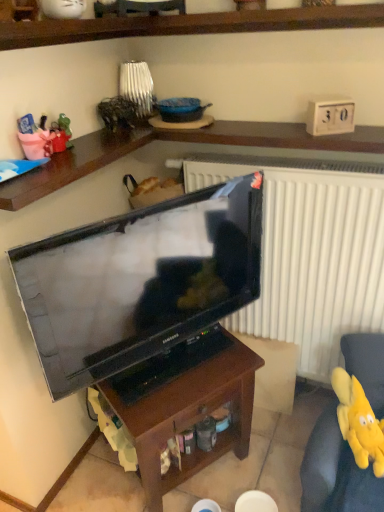
Question: Is matte black television at center bigger or smaller than yellow plush toy at lower right?

Choices:
 (A) big
 (B) small

Answer: (B)

Question: Is matte black television at center wider or thinner than yellow plush toy at lower right?

Choices:
 (A) wide
 (B) thin

Answer: (B)

Question: Considering the real-world distances, which object is closest to the yellow plush toy at lower right?

Choices:
 (A) brown wood table at center
 (B) matte black television at center
 (C) yellow plush toy at lower right

Answer: (C)

Question: Estimate the real-world distances between objects in this image. Which object is farther from the yellow plush toy at lower right?

Choices:
 (A) yellow plush toy at lower right
 (B) matte black television at center
 (C) brown wood table at center

Answer: (B)